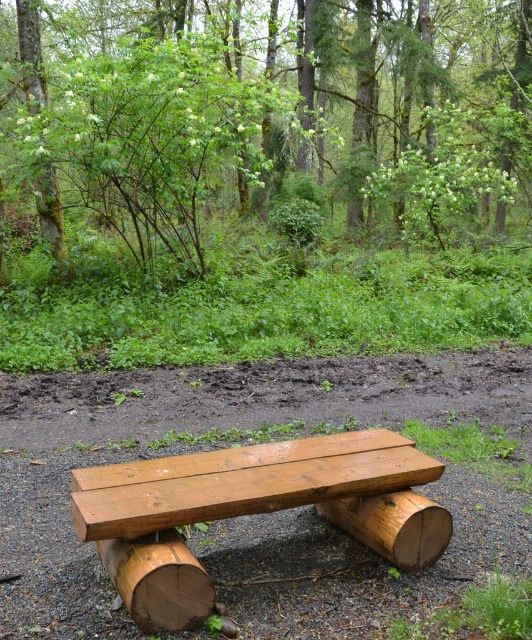
Locate an element on the screen. green leafy tree at upper center is located at coordinates (264, 108).

The height and width of the screenshot is (640, 532). Describe the element at coordinates (264, 108) in the screenshot. I see `green leafy tree at upper center` at that location.

Who is more distant from viewer, (10, 49) or (436, 509)?

The point (10, 49) is behind.

Identify the location of green leafy tree at upper center. (264, 108).

Who is positioned more to the left, green leafy tree at upper center or green mossy tree trunk at upper left?

From the viewer's perspective, green mossy tree trunk at upper left appears more on the left side.

Locate an element on the screen. The height and width of the screenshot is (640, 532). green leafy tree at upper center is located at coordinates (264, 108).

The image size is (532, 640). Find the location of `green leafy tree at upper center`. green leafy tree at upper center is located at coordinates (264, 108).

Which is more to the right, green leafy tree at upper center or natural wood log at center?

Positioned to the right is natural wood log at center.

Does green leafy tree at upper center appear on the left side of natural wood log at center?

Correct, you'll find green leafy tree at upper center to the left of natural wood log at center.

Image resolution: width=532 pixels, height=640 pixels. In order to click on green leafy tree at upper center in this screenshot , I will do `click(264, 108)`.